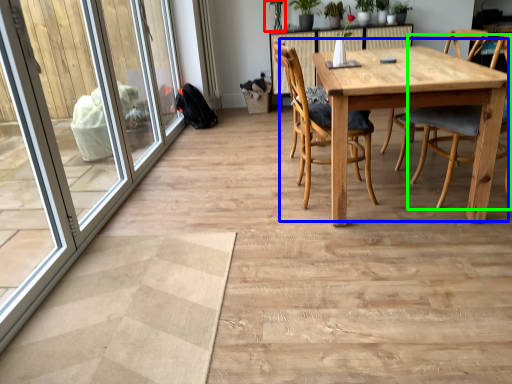
Question: Considering the real-world distances, which object is closest to plant (highlighted by a red box)? kitchen & dining room table (highlighted by a blue box) or chair (highlighted by a green box).

Choices:
 (A) kitchen & dining room table
 (B) chair

Answer: (A)